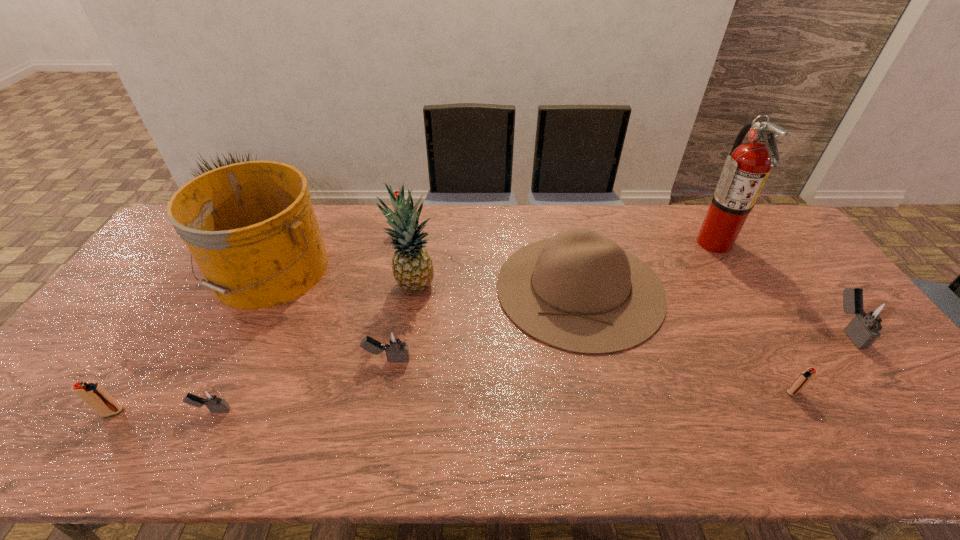
This screenshot has height=540, width=960. In order to click on blank space located on the nozzle side of the tallest object in this screenshot , I will do `click(598, 242)`.

The width and height of the screenshot is (960, 540). Find the location of `vacant space situated on the nozzle side of the tallest object`. vacant space situated on the nozzle side of the tallest object is located at coordinates (604, 242).

The width and height of the screenshot is (960, 540). In order to click on vacant point located 0.170m on the back of the pineapple in this screenshot , I will do `click(420, 238)`.

In order to click on blank space located 0.210m on the front of the bucket in this screenshot , I will do `click(214, 379)`.

Where is `vacant space located 0.190m on the right of the fourth tallest object`? The height and width of the screenshot is (540, 960). vacant space located 0.190m on the right of the fourth tallest object is located at coordinates (726, 288).

At what (x,y) coordinates should I click in order to perform the action: click on free region located on the left of the farthest igniter. Please return your answer as a coordinate pair (x, y). The width and height of the screenshot is (960, 540). Looking at the image, I should click on (369, 230).

At what (x,y) coordinates should I click in order to perform the action: click on free spot located on the left of the rightmost igniter. Please return your answer as a coordinate pair (x, y). The height and width of the screenshot is (540, 960). Looking at the image, I should click on (771, 329).

The height and width of the screenshot is (540, 960). Find the location of `vacant space situated on the right of the second gray igniter from right to left`. vacant space situated on the right of the second gray igniter from right to left is located at coordinates (518, 359).

Where is `vacant space located on the back of the leftmost red igniter`? vacant space located on the back of the leftmost red igniter is located at coordinates (193, 289).

You are a GUI agent. You are given a task and a screenshot of the screen. Output one action in this format:
    pyautogui.click(x=<x>, y=<y>)
    Task: Click on the free point located 0.210m on the right of the rightmost red igniter
    The width and height of the screenshot is (960, 540).
    Given the screenshot: What is the action you would take?
    pyautogui.click(x=886, y=392)